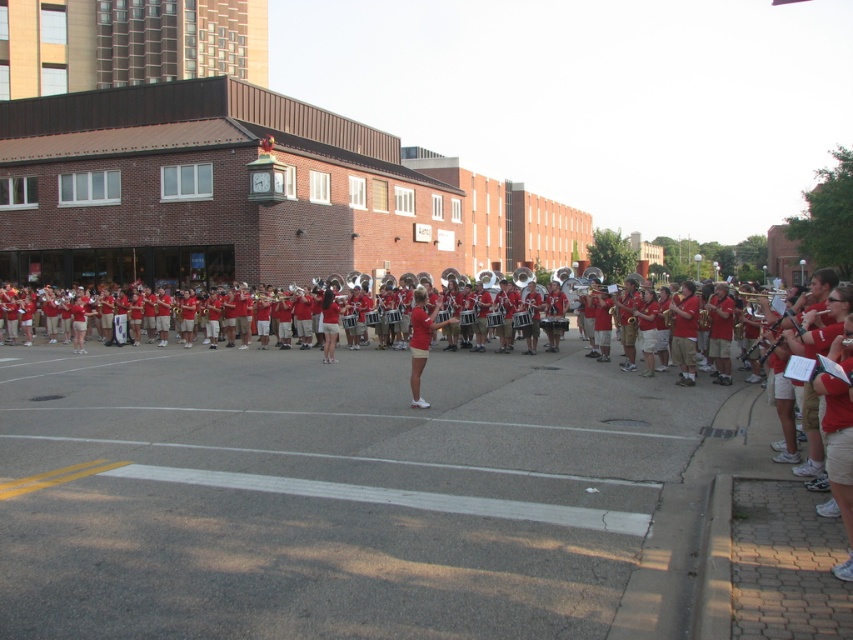
You are a member of the marching band and want to move from your current position to the conductor. You notice two points marked on the ground. One is at point (706,381) and the other is at point (416,305). Which point is closer to you as you face the band?

Point (416,305) is closer to you because it is less further away than point (706,381).

You are a photographer positioned at the center of the scene. You want to capture a closeup shot of the red smooth uniform at center. Which direction should you move to get closer to it?

The red smooth uniform at center is located at point 0.762 on the x axis and 0.438 on the y axis. Since you are at the center of the scene, you should move towards the right and slightly downward to reach the red smooth uniform at center.

You are standing at the point with coordinates point (845,417) and want to walk towards the point with coordinates point (466,410). Will you be moving forward or backward relative to your current position?

Since point (466,410) is behind point (845,417), moving towards it would mean you are moving backward relative to your current position.